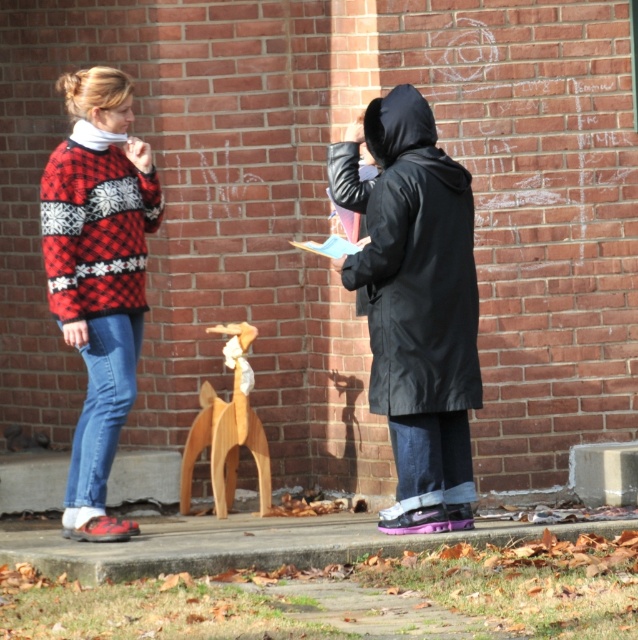
Question: Among these points, which one is farthest from the camera?

Choices:
 (A) (119, 269)
 (B) (248, 444)

Answer: (B)

Question: Is red and white knitted sweater at left thinner than red plaid sweater at left?

Choices:
 (A) no
 (B) yes

Answer: (B)

Question: Can you confirm if black matte coat at center is bigger than wooden horse at center?

Choices:
 (A) no
 (B) yes

Answer: (B)

Question: Considering the relative positions of red and white knitted sweater at left and black matte coat at center in the image provided, where is red and white knitted sweater at left located with respect to black matte coat at center?

Choices:
 (A) right
 (B) left

Answer: (B)

Question: Which point appears farthest from the camera in this image?

Choices:
 (A) (239, 442)
 (B) (110, 278)
 (C) (463, 228)
 (D) (140, 227)

Answer: (A)

Question: Among these points, which one is farthest from the camera?

Choices:
 (A) (75, 93)
 (B) (267, 488)
 (C) (82, 288)
 (D) (459, 362)

Answer: (B)